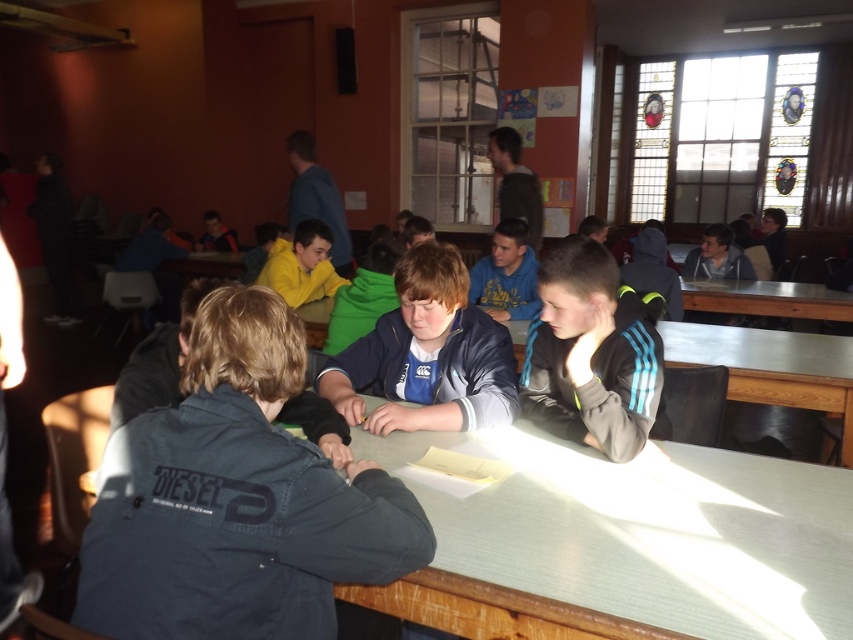
Question: Estimate the real-world distances between objects in this image. Which object is closer to the wooden table at right?

Choices:
 (A) smooth wooden table at center
 (B) blue fleece jacket at center

Answer: (B)

Question: Is dark blue jacket at center below blue fleece jacket at center?

Choices:
 (A) no
 (B) yes

Answer: (B)

Question: Among these objects, which one is farthest from the camera?

Choices:
 (A) yellow fleece jacket at center
 (B) black matte jacket at center

Answer: (A)

Question: Does smooth wooden table at center have a greater width compared to wooden table at right?

Choices:
 (A) no
 (B) yes

Answer: (A)

Question: Does smooth wooden table at center appear on the right side of dark blue jacket at center?

Choices:
 (A) yes
 (B) no

Answer: (A)

Question: Among these objects, which one is nearest to the camera?

Choices:
 (A) dark gray hoodie at center
 (B) smooth wooden table at center

Answer: (B)